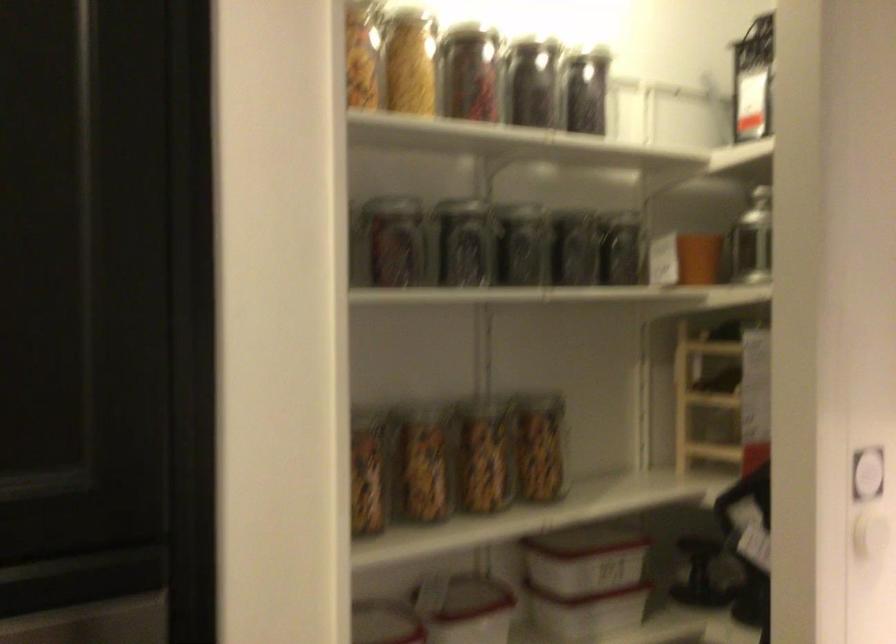
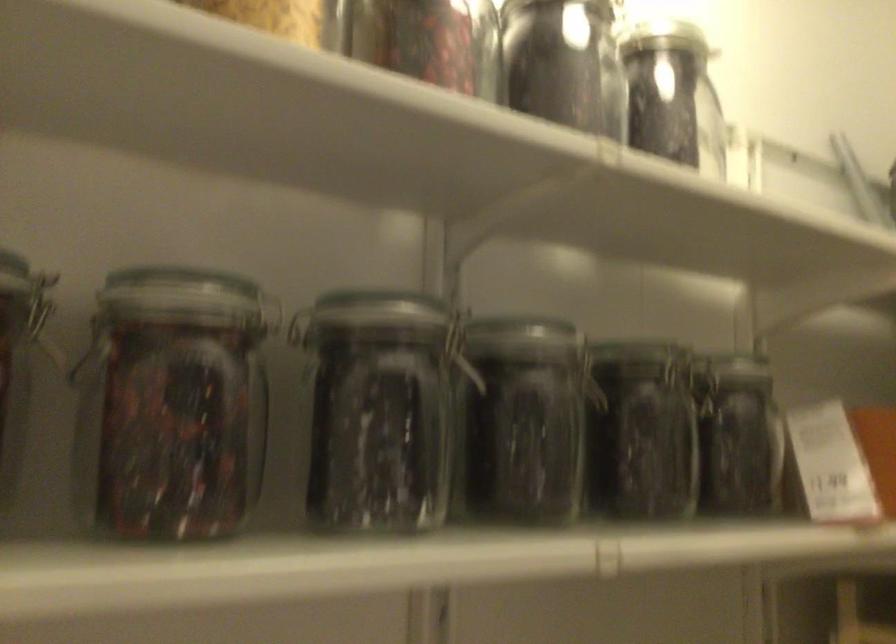
In the second image, find the point that corresponds to point (467, 243) in the first image.

(376, 410)